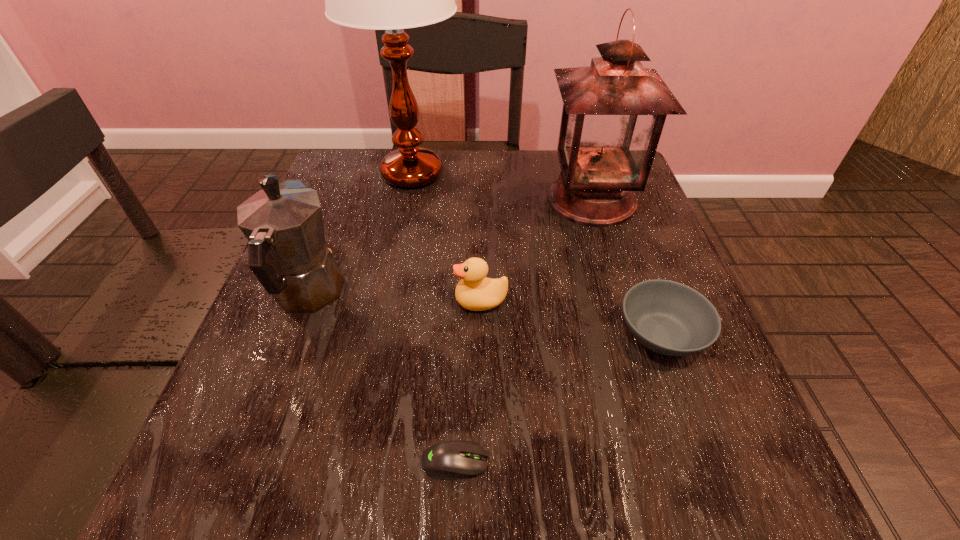
Where is `vacant region located 0.380m on the pouring side of the fourth shortest object`? The image size is (960, 540). vacant region located 0.380m on the pouring side of the fourth shortest object is located at coordinates (360, 156).

Locate an element on the screen. This screenshot has height=540, width=960. free space located on the pouring side of the fourth shortest object is located at coordinates (332, 230).

Where is `free spot located 0.120m at the beak of the duck`? The height and width of the screenshot is (540, 960). free spot located 0.120m at the beak of the duck is located at coordinates (387, 300).

The width and height of the screenshot is (960, 540). Identify the location of vacant position located 0.310m at the beak of the duck. (279, 300).

Identify the location of vacant space located 0.300m at the beak of the duck. This screenshot has height=540, width=960. click(285, 300).

Locate an element on the screen. The width and height of the screenshot is (960, 540). vacant space located on the left of the second shortest object is located at coordinates (417, 334).

This screenshot has height=540, width=960. Find the location of `vacant space located 0.120m on the wheel side of the shortest object`. vacant space located 0.120m on the wheel side of the shortest object is located at coordinates (581, 462).

Where is `table lamp that is at the far edge`? The image size is (960, 540). table lamp that is at the far edge is located at coordinates (392, 0).

At what (x,y) coordinates should I click in order to perform the action: click on oil lamp that is at the far edge. Please return your answer as a coordinate pair (x, y). This screenshot has height=540, width=960. Looking at the image, I should click on (614, 111).

At what (x,y) coordinates should I click in order to perform the action: click on object situated at the near edge. Please return your answer as a coordinate pair (x, y). Looking at the image, I should click on (451, 460).